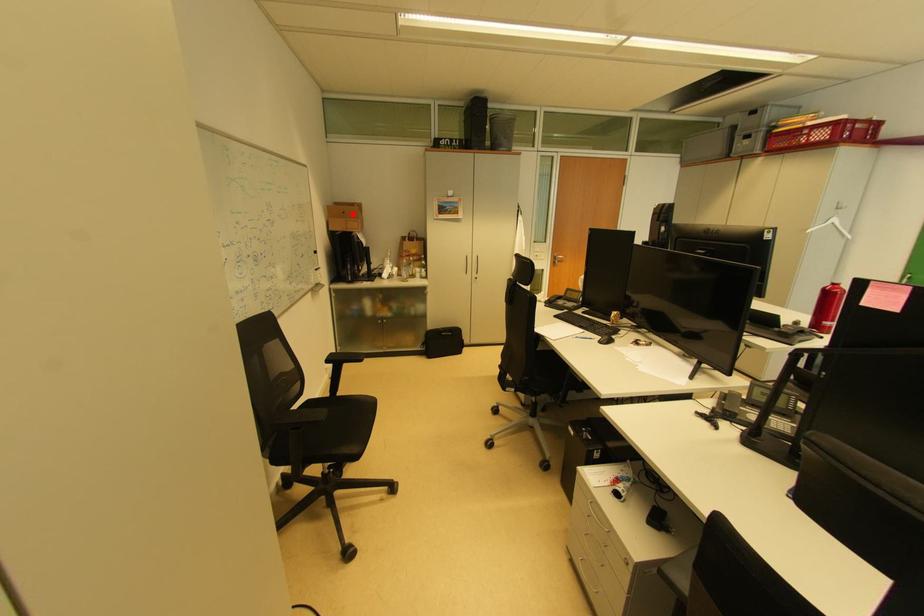
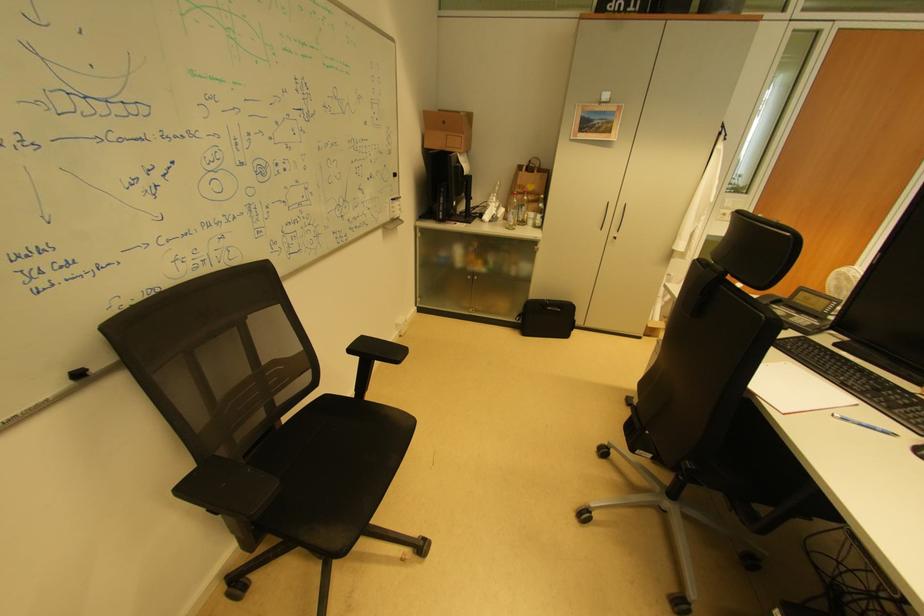
Locate, in the second image, the point that corresponds to the highlighted location in the first image.

(453, 124)